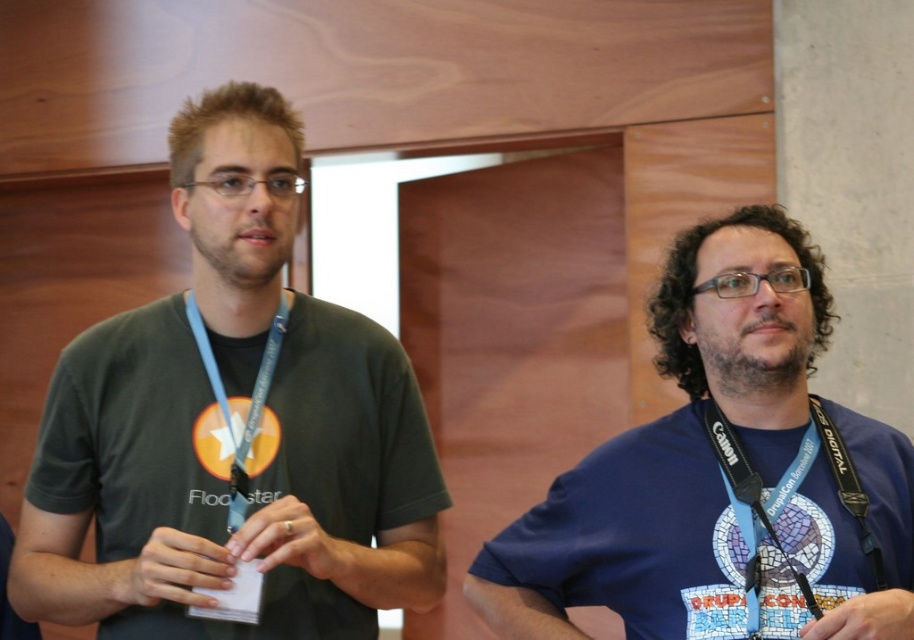
Does dark green t-shirt at left come behind blue fabric lanyard at left?

No.

Consider the image. Between dark green t-shirt at left and blue fabric lanyard at left, which one appears on the right side from the viewer's perspective?

blue fabric lanyard at left

Is point (245, 403) positioned after point (262, 358)?

No, it is in front of (262, 358).

The height and width of the screenshot is (640, 914). Find the location of `dark green t-shirt at left`. dark green t-shirt at left is located at coordinates (227, 481).

Is point (744, 376) farther from viewer compared to point (284, 256)?

Yes.

Can you confirm if black fabric at center is smaller than matte green neck at center?

Incorrect, black fabric at center is not smaller in size than matte green neck at center.

Between point (774, 264) and point (243, 278), which one is positioned in front?

Point (243, 278) is in front.

Where is `black fabric at center`? black fabric at center is located at coordinates (760, 387).

Does matte green neck at center have a smaller size compared to blue fabric lanyard at left?

Correct, matte green neck at center occupies less space than blue fabric lanyard at left.

Is point (248, 276) positioned after point (247, 486)?

Yes, point (248, 276) is farther from viewer.

This screenshot has width=914, height=640. What do you see at coordinates (237, 284) in the screenshot? I see `matte green neck at center` at bounding box center [237, 284].

Identify the location of matte green neck at center. This screenshot has width=914, height=640. (237, 284).